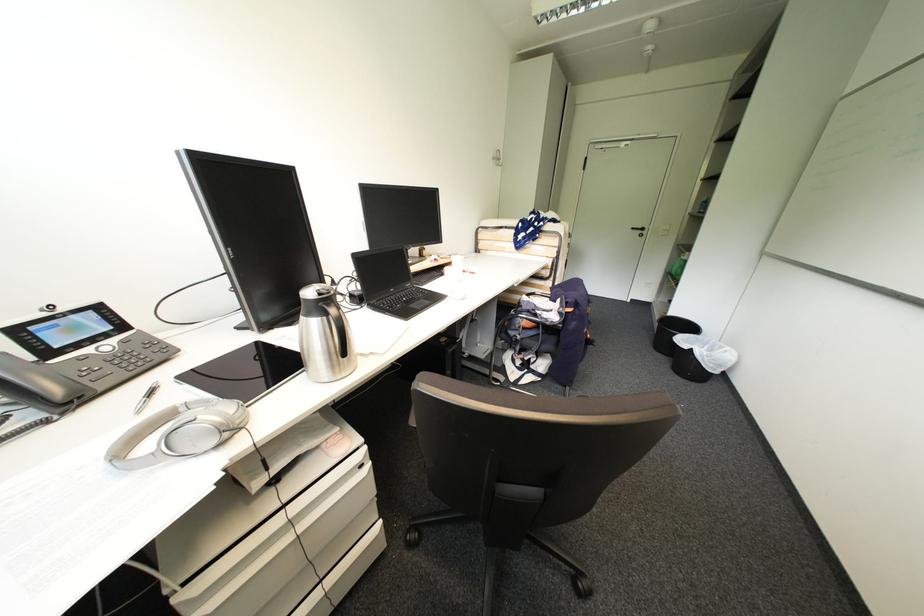
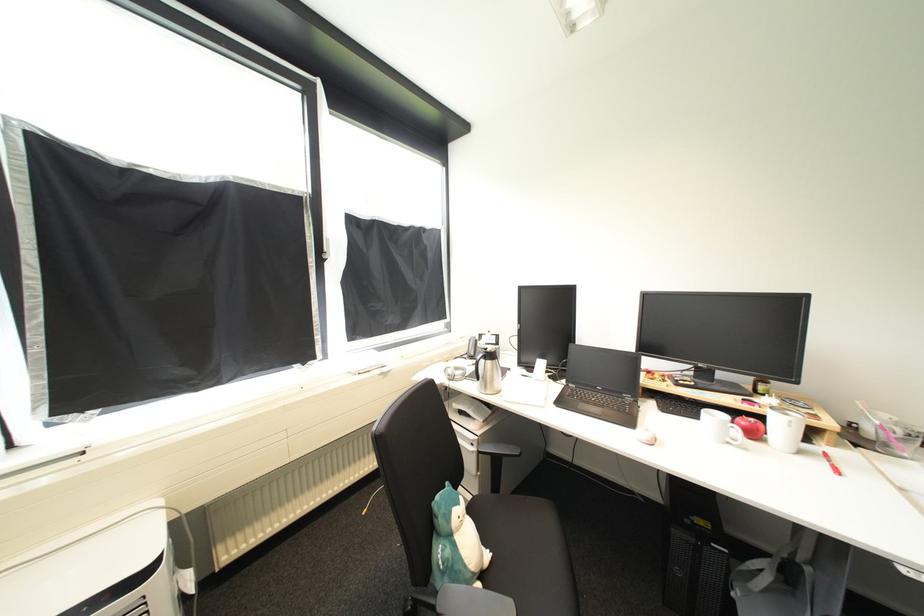
Locate, in the second image, the point that corresponds to pixel 456 262 in the first image.

(784, 419)